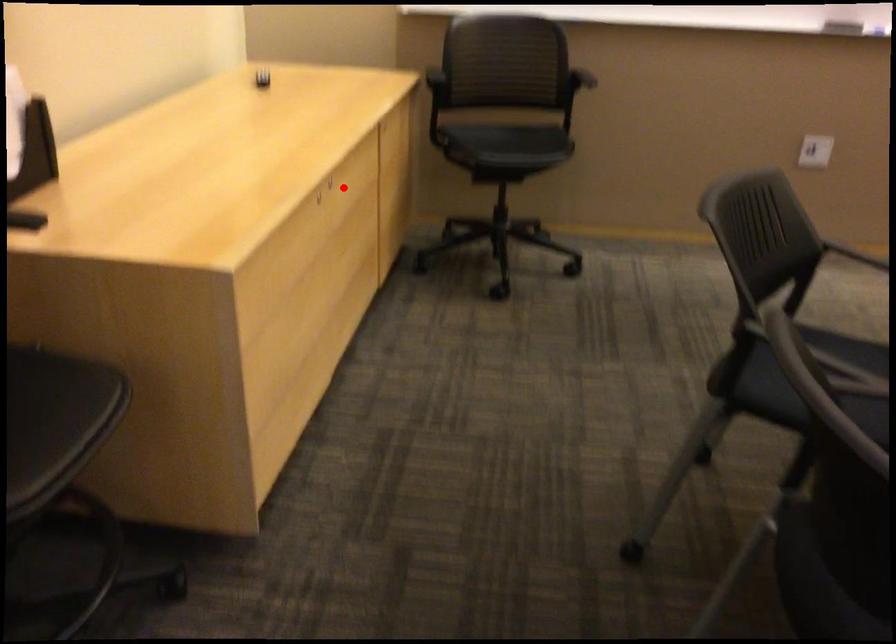
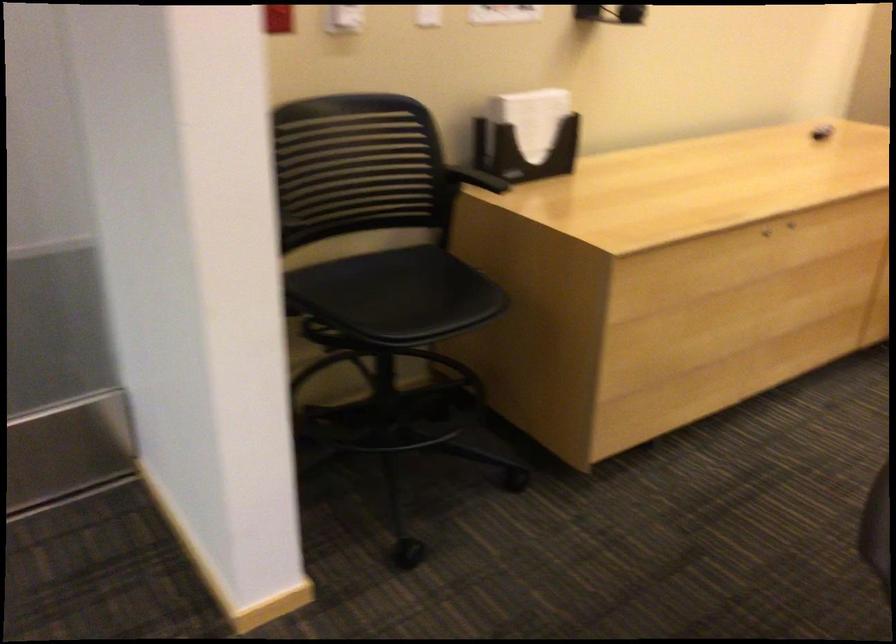
The point at the highlighted location is marked in the first image. Where is the corresponding point in the second image?

(790, 225)